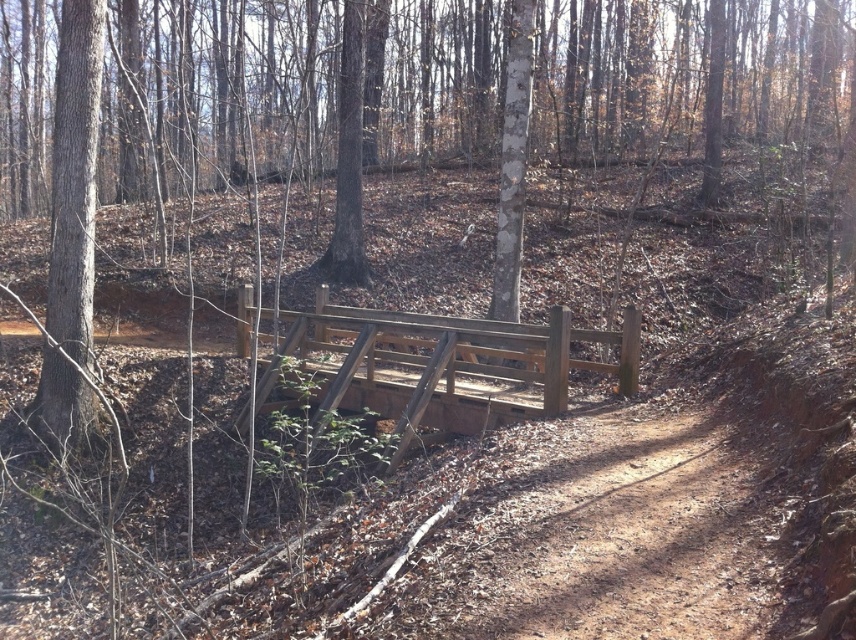
You are a hiker carrying a backpack and need to cross the wooden bridge in the forest. The bridge is narrow and can only hold one person at a time. You see the smooth brown tree trunk at left and the smooth brown tree at center. How far apart are these two trees?

The distance between the smooth brown tree trunk at left and the smooth brown tree at center is 7.36 meters.

You are standing on the wooden bridge in the forest scene. You notice a point marked at coordinates (70, 230). What is the location of this point in relation to the nearest tree trunk?

The point at coordinates (70, 230) is located on a smooth brown tree trunk at the left side of the scene.

You are a hiker who wants to identify the tallest tree between the smooth brown tree trunk at left and the smooth brown tree at center. Which one should you choose?

The smooth brown tree at center is taller than the smooth brown tree trunk at left, so you should choose the smooth brown tree at center.